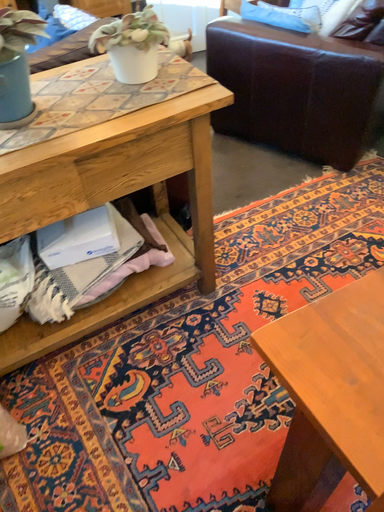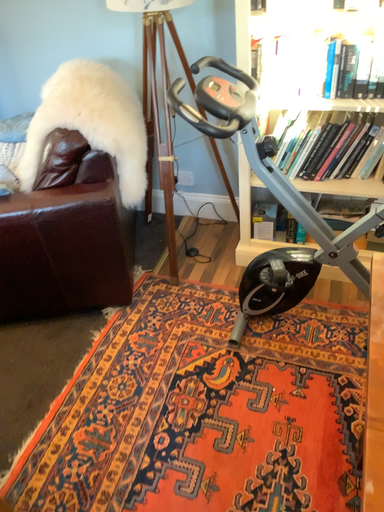
Question: Which way did the camera rotate in the video?

Choices:
 (A) rotated right
 (B) rotated left

Answer: (A)